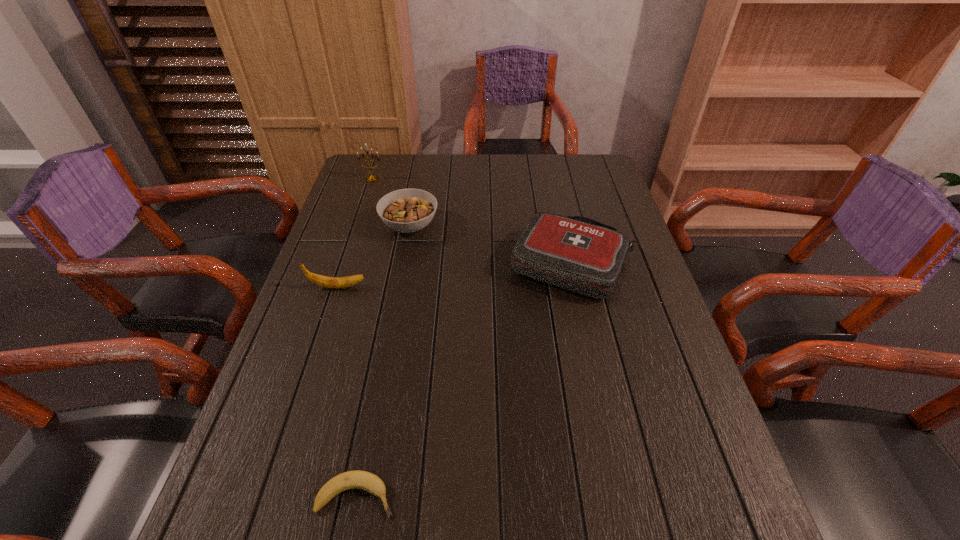
Identify the location of vacant point located on the peel of the left banana from the top. The image size is (960, 540). (495, 287).

Where is `vacant space located on the right of the stew`? Image resolution: width=960 pixels, height=540 pixels. vacant space located on the right of the stew is located at coordinates (484, 226).

In order to click on vacant space located 0.330m at the stem of the right banana in this screenshot , I will do `click(578, 496)`.

In order to click on object present at the far edge in this screenshot , I will do `click(373, 178)`.

Image resolution: width=960 pixels, height=540 pixels. In order to click on candelabrum that is at the left edge in this screenshot , I will do `click(373, 178)`.

Locate an element on the screen. The image size is (960, 540). banana located in the left edge section of the desktop is located at coordinates (329, 282).

Identify the location of stew at the left edge. (409, 210).

Identify the location of object that is at the right edge. The image size is (960, 540). (577, 253).

The width and height of the screenshot is (960, 540). What are the coordinates of `object that is at the far left corner` in the screenshot? It's located at (373, 178).

At what (x,y) coordinates should I click in order to perform the action: click on free region at the far edge of the desktop. Please return your answer as a coordinate pair (x, y). The image size is (960, 540). Looking at the image, I should click on (427, 161).